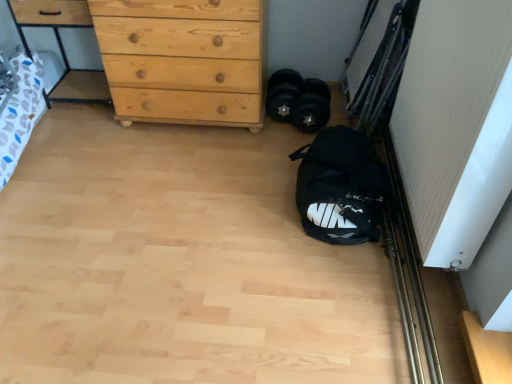
Question: From a real-world perspective, is black fabric sack at lower right positioned over black rubber dumbbells at center based on gravity?

Choices:
 (A) no
 (B) yes

Answer: (B)

Question: Considering the relative sizes of black fabric sack at lower right and black rubber dumbbells at center in the image provided, is black fabric sack at lower right smaller than black rubber dumbbells at center?

Choices:
 (A) yes
 (B) no

Answer: (B)

Question: Does black fabric sack at lower right lie behind black rubber dumbbells at center?

Choices:
 (A) no
 (B) yes

Answer: (A)

Question: From a real-world perspective, is black fabric sack at lower right beneath black rubber dumbbells at center?

Choices:
 (A) no
 (B) yes

Answer: (A)

Question: From the image's perspective, would you say black fabric sack at lower right is shown under black rubber dumbbells at center?

Choices:
 (A) yes
 (B) no

Answer: (A)

Question: Is black fabric sack at lower right with black rubber dumbbells at center?

Choices:
 (A) yes
 (B) no

Answer: (B)

Question: From the image's perspective, is black rubber dumbbells at center on natural wood chest of drawers at upper left?

Choices:
 (A) no
 (B) yes

Answer: (A)

Question: Is black rubber dumbbells at center next to natural wood chest of drawers at upper left?

Choices:
 (A) no
 (B) yes

Answer: (A)

Question: Can you confirm if black rubber dumbbells at center is positioned to the right of natural wood chest of drawers at upper left?

Choices:
 (A) yes
 (B) no

Answer: (A)

Question: Is black rubber dumbbells at center behind natural wood chest of drawers at upper left?

Choices:
 (A) no
 (B) yes

Answer: (B)

Question: Considering the relative sizes of black rubber dumbbells at center and natural wood chest of drawers at upper left in the image provided, is black rubber dumbbells at center wider than natural wood chest of drawers at upper left?

Choices:
 (A) no
 (B) yes

Answer: (A)

Question: Is black rubber dumbbells at center to the left of natural wood chest of drawers at upper left from the viewer's perspective?

Choices:
 (A) no
 (B) yes

Answer: (A)

Question: From a real-world perspective, is natural wood chest of drawers at upper left physically above natural wood dresser at upper left?

Choices:
 (A) yes
 (B) no

Answer: (A)